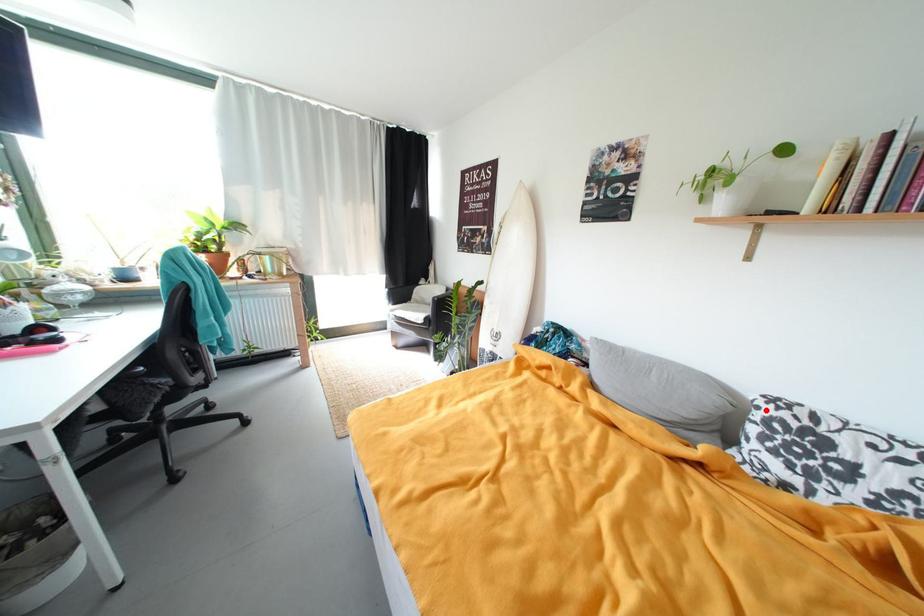
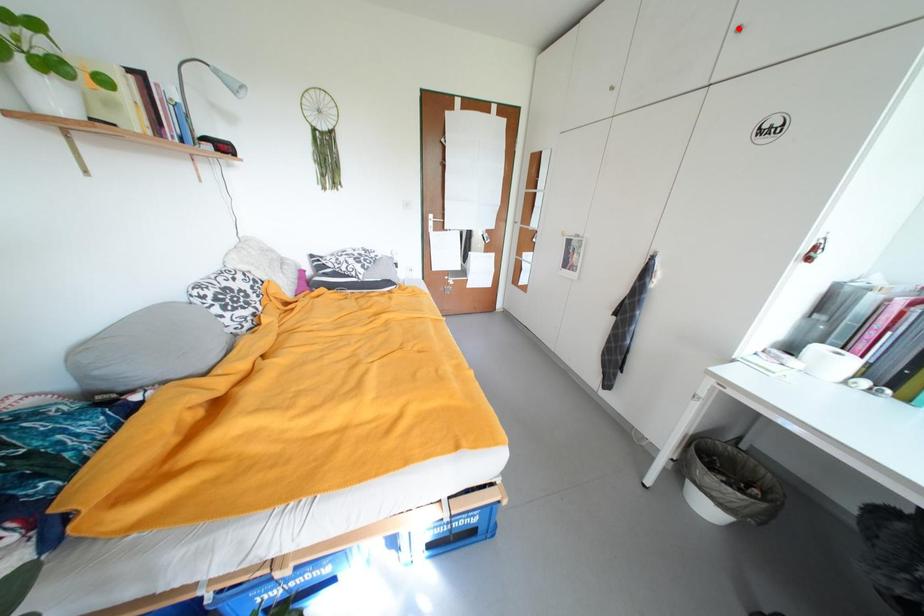
I am providing you with two images of the same scene from different viewpoints. A red point is marked on the first image and another point is marked on the second image. Do the highlighted points in image1 and image2 indicate the same real-world spot?

No